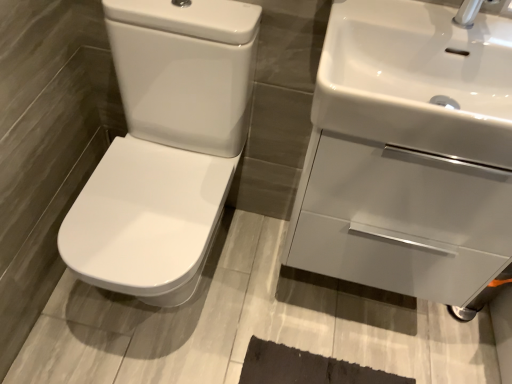
Question: Is white glossy sink at upper right, which is counted as the 1th sink, starting from the front, wider than white glossy toilet at left?

Choices:
 (A) no
 (B) yes

Answer: (A)

Question: Is white glossy sink at upper right, which is counted as the 1th sink, starting from the front, oriented towards white glossy toilet at left?

Choices:
 (A) no
 (B) yes

Answer: (A)

Question: Can you confirm if white glossy sink at upper right, which appears as the second sink when viewed from the back, is bigger than white glossy toilet at left?

Choices:
 (A) yes
 (B) no

Answer: (B)

Question: Is white glossy sink at upper right, which is counted as the 1th sink, starting from the front, not near white glossy toilet at left?

Choices:
 (A) no
 (B) yes

Answer: (A)

Question: Is white glossy sink at upper right, which is counted as the 1th sink, starting from the front, in contact with white glossy toilet at left?

Choices:
 (A) no
 (B) yes

Answer: (A)

Question: From the image's perspective, is white glossy toilet at left located above or below white glossy sink at upper right, which is counted as the 1th sink, starting from the front?

Choices:
 (A) below
 (B) above

Answer: (A)

Question: From a real-world perspective, is white glossy toilet at left positioned above or below white glossy sink at upper right, which appears as the second sink when viewed from the back?

Choices:
 (A) below
 (B) above

Answer: (A)

Question: Considering the relative positions of white glossy toilet at left and white glossy sink at upper right, which appears as the second sink when viewed from the back, in the image provided, is white glossy toilet at left to the left or to the right of white glossy sink at upper right, which appears as the second sink when viewed from the back,?

Choices:
 (A) right
 (B) left

Answer: (B)

Question: Would you say white glossy toilet at left is inside or outside white glossy sink at upper right, which is counted as the 1th sink, starting from the front?

Choices:
 (A) outside
 (B) inside

Answer: (A)

Question: Is white glossy sink at upper right, which appears as the second sink when viewed from the back, wider or thinner than white glossy toilet at left?

Choices:
 (A) wide
 (B) thin

Answer: (B)

Question: Considering the relative positions of white glossy sink at upper right, which is counted as the 1th sink, starting from the front, and white glossy toilet at left in the image provided, is white glossy sink at upper right, which is counted as the 1th sink, starting from the front, to the left or to the right of white glossy toilet at left?

Choices:
 (A) right
 (B) left

Answer: (A)

Question: In terms of size, does white glossy sink at upper right, which appears as the second sink when viewed from the back, appear bigger or smaller than white glossy toilet at left?

Choices:
 (A) small
 (B) big

Answer: (A)

Question: From the image's perspective, is white glossy sink at upper right, which is counted as the 1th sink, starting from the front, above or below white glossy toilet at left?

Choices:
 (A) above
 (B) below

Answer: (A)

Question: Is white glossy sink at upper right, which is the first sink in back-to-front order, to the left or to the right of white glossy toilet at left in the image?

Choices:
 (A) left
 (B) right

Answer: (B)

Question: In terms of size, does white glossy sink at upper right, the 2th sink viewed from the front, appear bigger or smaller than white glossy toilet at left?

Choices:
 (A) big
 (B) small

Answer: (B)